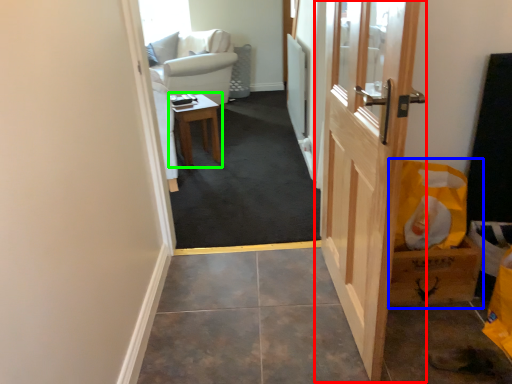
Question: Which is farther away from door (highlighted by a red box)? cardboard box (highlighted by a blue box) or table (highlighted by a green box)?

Choices:
 (A) cardboard box
 (B) table

Answer: (B)